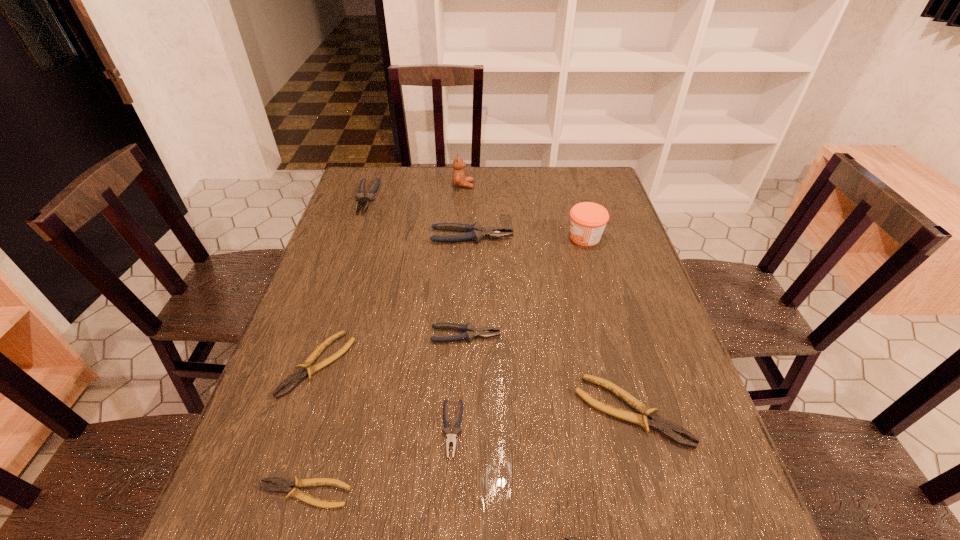
Where is `teddy bear`? Image resolution: width=960 pixels, height=540 pixels. teddy bear is located at coordinates (459, 180).

At what (x,y) coordinates should I click in order to perform the action: click on the tallest object. Please return your answer as a coordinate pair (x, y). The image size is (960, 540). Looking at the image, I should click on (459, 180).

Find the location of `the second tallest object`. the second tallest object is located at coordinates (588, 220).

You are a GUI agent. You are given a task and a screenshot of the screen. Output one action in this format:
    pyautogui.click(x=<x>, y=<y>)
    Task: Click on the third tallest object
    The height and width of the screenshot is (540, 960).
    Given the screenshot: What is the action you would take?
    click(476, 232)

At what (x,y) coordinates should I click in order to perform the action: click on the second farthest pliers. Please return your answer as a coordinate pair (x, y). Looking at the image, I should click on (476, 232).

The height and width of the screenshot is (540, 960). In order to click on the farthest gray pliers in this screenshot , I will do `click(370, 195)`.

Find the location of a particular element. This screenshot has height=540, width=960. the seventh shortest pliers is located at coordinates (370, 195).

Where is `the second nearest gray pliers`? the second nearest gray pliers is located at coordinates (470, 332).

Find the location of a particular element. Image resolution: width=960 pixels, height=540 pixels. the biggest yellow pliers is located at coordinates (657, 423).

The height and width of the screenshot is (540, 960). What are the coordinates of `the second biggest yellow pliers` in the screenshot? It's located at (305, 369).